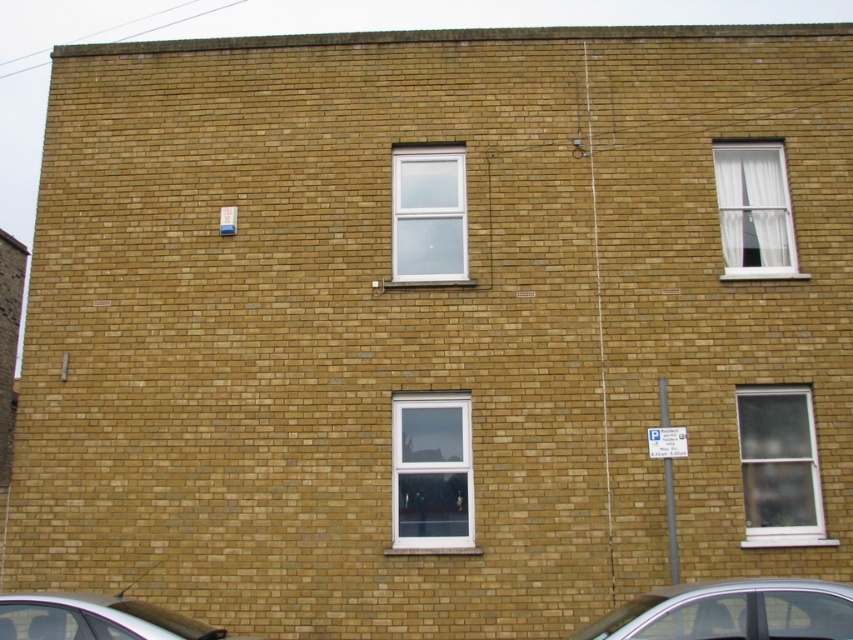
Which is more to the right, silver metallic car at lower right or clear glass window at right?

clear glass window at right

Can you confirm if silver metallic car at lower right is smaller than clear glass window at right?

No.

Does point (653, 616) lie behind point (740, 444)?

No, (653, 616) is in front of (740, 444).

I want to click on silver metallic car at lower right, so click(732, 611).

Which of these two, silver metallic car at lower right or clear glass window at upper center, stands shorter?

silver metallic car at lower right

Based on the photo, does silver metallic car at lower right have a larger size compared to clear glass window at upper center?

Indeed, silver metallic car at lower right has a larger size compared to clear glass window at upper center.

What do you see at coordinates (732, 611) in the screenshot?
I see `silver metallic car at lower right` at bounding box center [732, 611].

Image resolution: width=853 pixels, height=640 pixels. I want to click on silver metallic car at lower right, so click(x=732, y=611).

Consider the image. Is clear glass window at right above clear glass window at upper center?

No.

Which is behind, point (779, 438) or point (421, 256)?

Positioned behind is point (421, 256).

I want to click on clear glass window at right, so click(x=779, y=468).